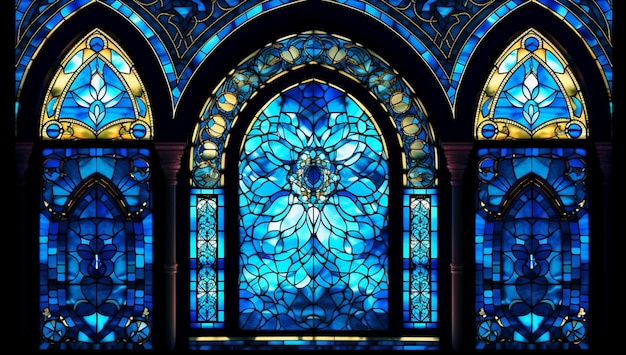
Locate an element on the screen. This screenshot has width=626, height=355. right blue vertical rectangular window is located at coordinates (429, 254).